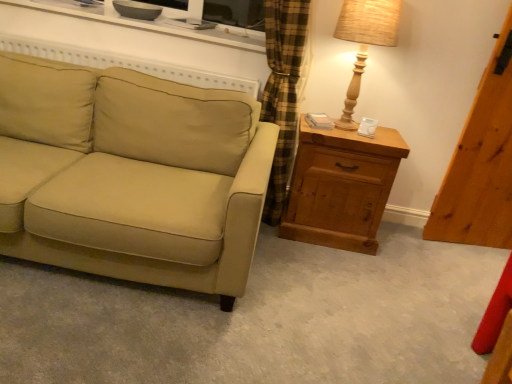
Question: Could you tell me if wooden chest of drawers at right is facing wooden table lamp at right?

Choices:
 (A) no
 (B) yes

Answer: (A)

Question: Can you confirm if wooden chest of drawers at right is thinner than wooden table lamp at right?

Choices:
 (A) yes
 (B) no

Answer: (B)

Question: Can you confirm if wooden chest of drawers at right is smaller than wooden table lamp at right?

Choices:
 (A) yes
 (B) no

Answer: (B)

Question: Does wooden chest of drawers at right have a greater height compared to wooden table lamp at right?

Choices:
 (A) yes
 (B) no

Answer: (A)

Question: Is wooden chest of drawers at right positioned in front of wooden table lamp at right?

Choices:
 (A) no
 (B) yes

Answer: (A)

Question: Looking at the image, does wooden table lamp at right seem bigger or smaller compared to wooden chest of drawers at right?

Choices:
 (A) small
 (B) big

Answer: (A)

Question: Based on their positions, is wooden table lamp at right located to the left or right of wooden chest of drawers at right?

Choices:
 (A) left
 (B) right

Answer: (B)

Question: From their relative heights in the image, would you say wooden table lamp at right is taller or shorter than wooden chest of drawers at right?

Choices:
 (A) short
 (B) tall

Answer: (A)

Question: Is wooden table lamp at right spatially inside wooden chest of drawers at right, or outside of it?

Choices:
 (A) inside
 (B) outside

Answer: (B)

Question: Is white glossy entertainment center at upper center inside the boundaries of wooden chest of drawers at right, or outside?

Choices:
 (A) outside
 (B) inside

Answer: (A)

Question: Looking at their shapes, would you say white glossy entertainment center at upper center is wider or thinner than wooden chest of drawers at right?

Choices:
 (A) thin
 (B) wide

Answer: (B)

Question: From a real-world perspective, is white glossy entertainment center at upper center above or below wooden chest of drawers at right?

Choices:
 (A) above
 (B) below

Answer: (A)

Question: From the image's perspective, relative to wooden chest of drawers at right, is white glossy entertainment center at upper center above or below?

Choices:
 (A) above
 (B) below

Answer: (A)

Question: Looking at their shapes, would you say white glossy entertainment center at upper center is wider or thinner than wooden table lamp at right?

Choices:
 (A) thin
 (B) wide

Answer: (B)

Question: Is white glossy entertainment center at upper center spatially inside wooden table lamp at right, or outside of it?

Choices:
 (A) inside
 (B) outside

Answer: (B)